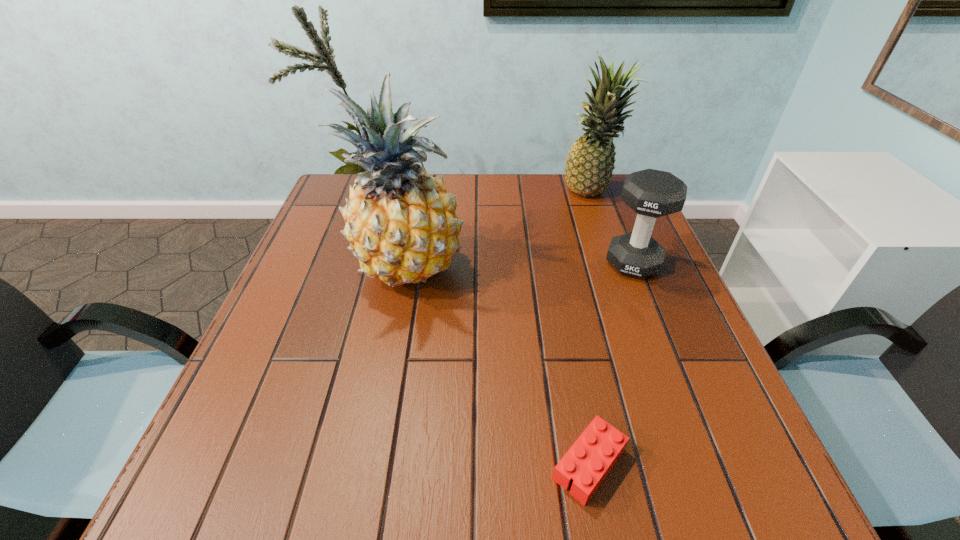
The width and height of the screenshot is (960, 540). I want to click on vacant area that lies between the dumbbell and the leftmost object, so click(521, 265).

I want to click on free space between the farther pineapple and the leftmost object, so click(500, 230).

At what (x,y) coordinates should I click in order to perform the action: click on free area in between the nearest object and the third tallest object. Please return your answer as a coordinate pair (x, y). Looking at the image, I should click on (611, 363).

What are the coordinates of `vacant region between the farther pineapple and the second shortest object` in the screenshot? It's located at (612, 228).

Identify the location of vacant space in between the farthest object and the nearer pineapple. The height and width of the screenshot is (540, 960). (500, 230).

Image resolution: width=960 pixels, height=540 pixels. I want to click on object that stands as the third closest to the third object from right to left, so click(590, 162).

You are a GUI agent. You are given a task and a screenshot of the screen. Output one action in this format:
    pyautogui.click(x=<x>, y=<y>)
    Task: Click on the object that is the closest to the second shortest object
    
    Given the screenshot: What is the action you would take?
    pyautogui.click(x=590, y=162)

Locate an element on the screen. This screenshot has width=960, height=540. vacant area in the image that satisfies the following two spatial constraints: 1. on the front side of the third tallest object; 2. on the left side of the right pineapple is located at coordinates (616, 263).